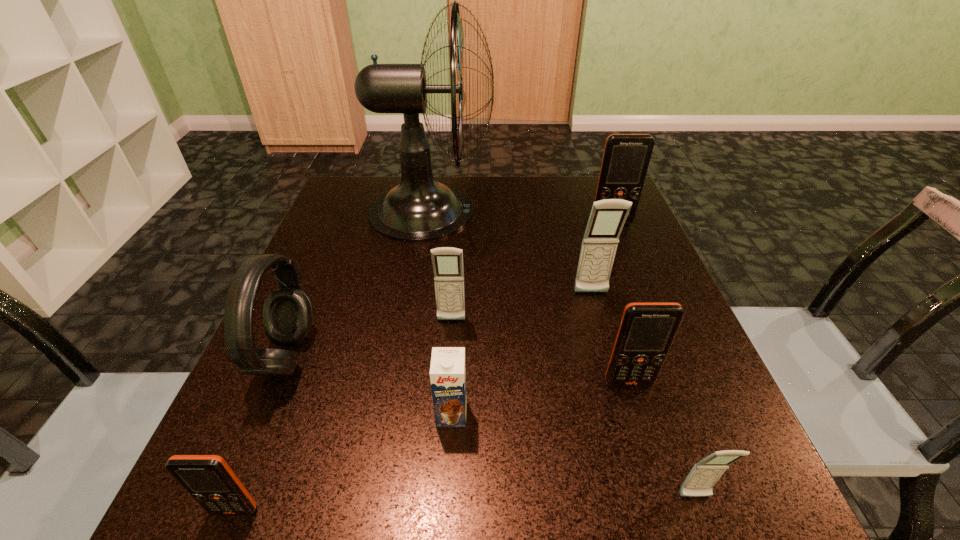
This screenshot has height=540, width=960. I want to click on free space located 0.170m on the screen of the second farthest orange cellular telephone, so click(x=663, y=496).

You are a GUI agent. You are given a task and a screenshot of the screen. Output one action in this format:
    pyautogui.click(x=<x>, y=<y>)
    Task: Click on the free space located on the front label of the chocolate milk
    The image size is (960, 540).
    Given the screenshot: What is the action you would take?
    pyautogui.click(x=446, y=503)

The image size is (960, 540). What are the coordinates of `fan that is positioned at the far edge` in the screenshot? It's located at (419, 209).

Find the location of a particular element. cellular telephone located in the far edge section of the desktop is located at coordinates (626, 157).

Identify the location of fan that is at the left edge. This screenshot has height=540, width=960. (419, 209).

Image resolution: width=960 pixels, height=540 pixels. I want to click on headset that is positioned at the left edge, so click(288, 311).

Image resolution: width=960 pixels, height=540 pixels. Identify the location of cellular telephone that is at the left edge. (208, 479).

Find the location of a particular element. The height and width of the screenshot is (540, 960). object that is at the far left corner is located at coordinates (419, 209).

You are a GUI agent. You are given a task and a screenshot of the screen. Output one action in this format:
    pyautogui.click(x=<x>, y=<y>)
    Task: Click on the object that is at the near left corner
    
    Given the screenshot: What is the action you would take?
    pyautogui.click(x=208, y=479)

This screenshot has height=540, width=960. What are the coordinates of `object present at the far right corner` in the screenshot? It's located at [626, 157].